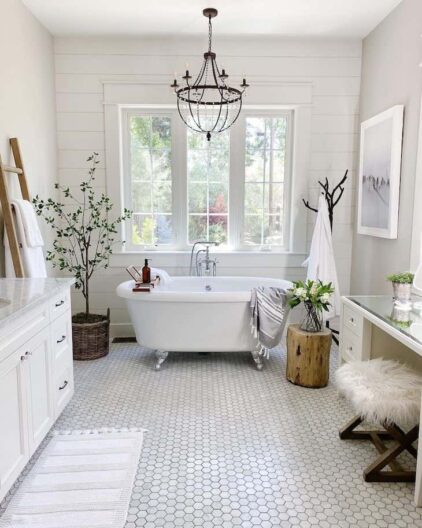
You are a GUI agent. You are given a task and a screenshot of the screen. Output one action in this format:
    pyautogui.click(x=<x>, y=<y>)
    Task: Click on the white faux fur seat topper
    The width and height of the screenshot is (422, 528).
    Given the screenshot: What is the action you would take?
    pyautogui.click(x=376, y=383)